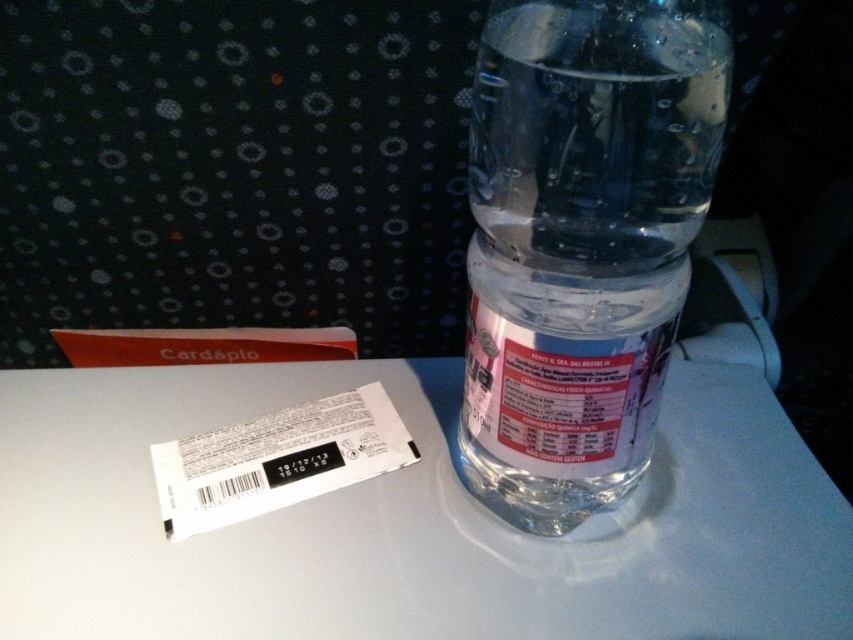
You are a flight attendant checking the table settings. You see a clear plastic bottle at center and a transparent plastic bottle at center. Which one is bigger?

The clear plastic bottle at center is larger in size than the transparent plastic bottle at center.

You are a flight attendant checking the table settings. You need to ensure that the clear plastic bottle at center and the transparent plastic bottle at center are placed properly. According to the airline guidelines, the wider bottle should be placed to the left to prevent tipping. Which bottle should be on the left side?

The clear plastic bottle at center is wider than the transparent plastic bottle at center, so it should be placed on the left side to comply with the airline guidelines.

You are a flight attendant checking the table settings. You see the clear plastic bottle at center and the transparent plastic bottle at center. Which one is shorter?

The clear plastic bottle at center is shorter than the transparent plastic bottle at center.